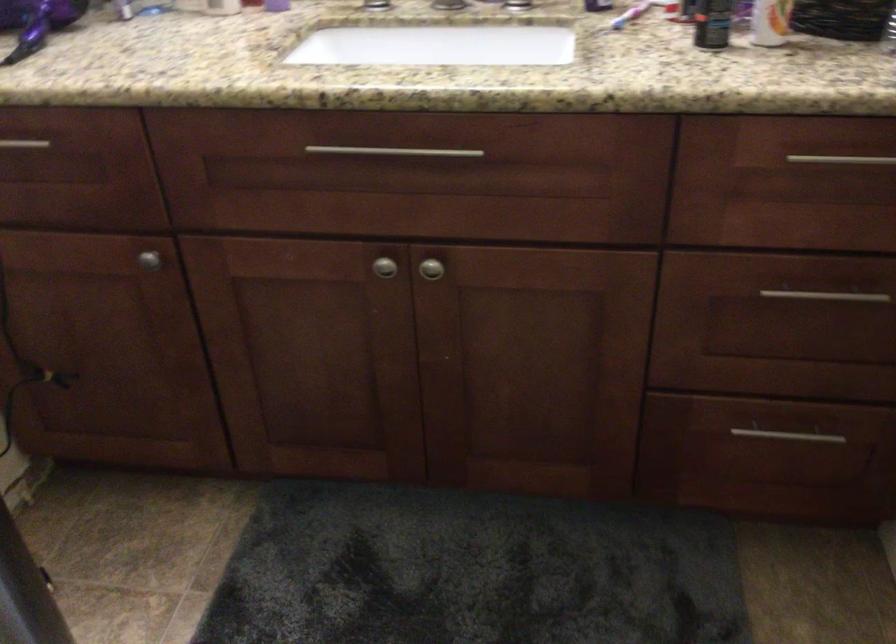
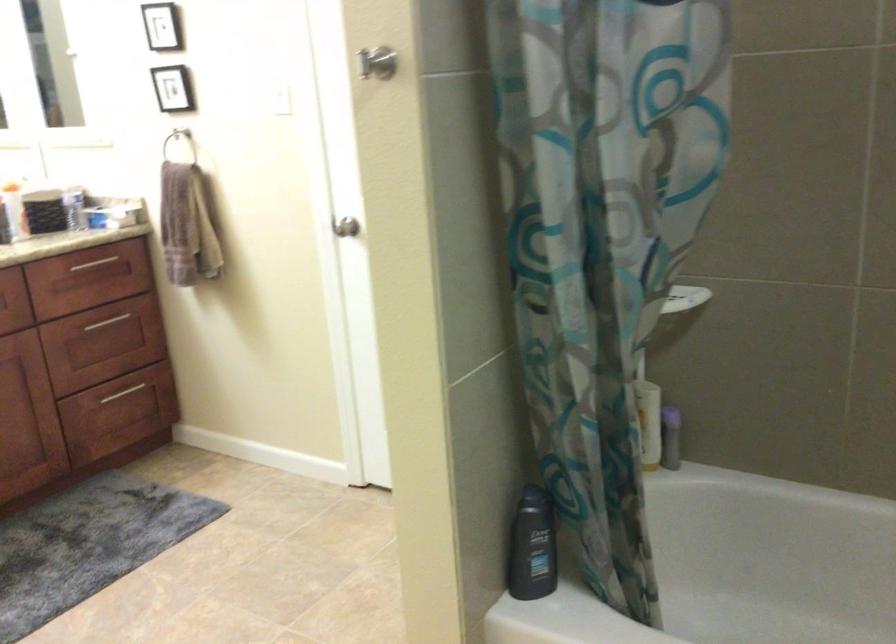
The point at (765, 440) is marked in the first image. Where is the corresponding point in the second image?

(122, 393)